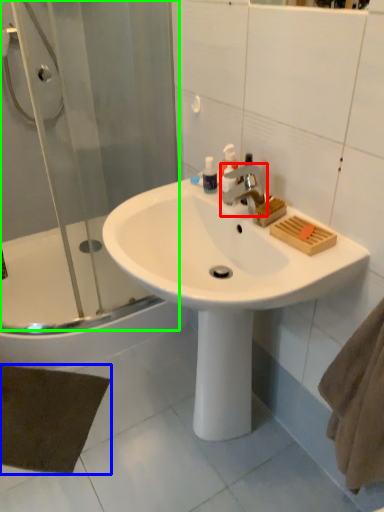
Question: Based on their relative distances, which object is farther from tap (highlighted by a red box)? Choose from bath mat (highlighted by a blue box) and shower door (highlighted by a green box).

Choices:
 (A) bath mat
 (B) shower door

Answer: (A)